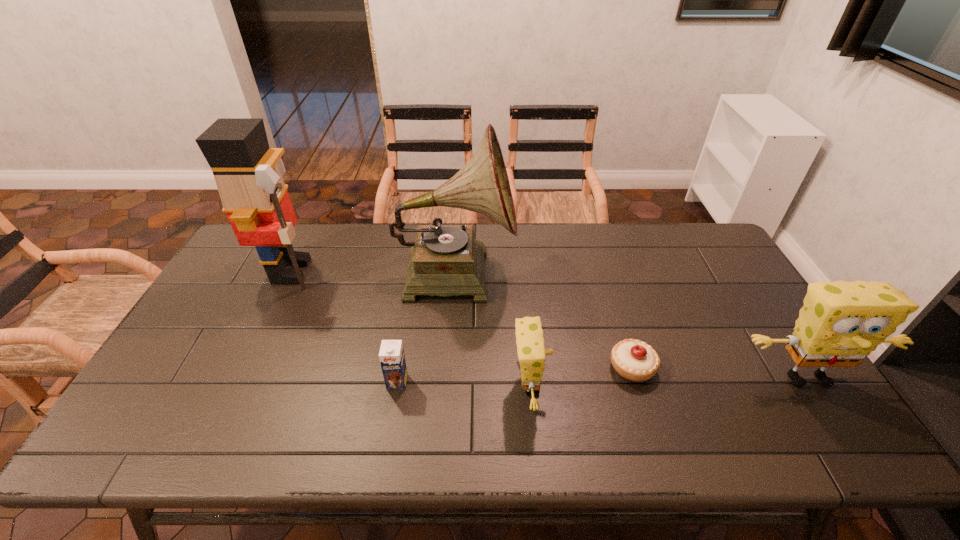
In order to click on vacant region located 0.210m from the horn of the record player in this screenshot , I will do coord(579,271).

The height and width of the screenshot is (540, 960). Identify the location of free space located 0.050m in front of the leftmost object holding the staff. (337, 271).

Locate an element on the screen. vacant area situated 0.050m on the front label of the chocolate milk is located at coordinates (394, 408).

Image resolution: width=960 pixels, height=540 pixels. Find the location of `free space located on the right of the second object from right to left`. free space located on the right of the second object from right to left is located at coordinates tap(762, 367).

Find the location of a particular element. The image size is (960, 540). record player at the far edge is located at coordinates (445, 260).

This screenshot has width=960, height=540. Find the location of `nutcracker located at the far edge`. nutcracker located at the far edge is located at coordinates (255, 198).

Locate an element on the screen. This screenshot has height=540, width=960. chocolate milk present at the near edge is located at coordinates (391, 355).

This screenshot has width=960, height=540. Find the location of `pastry that is positioned at the near edge`. pastry that is positioned at the near edge is located at coordinates (634, 360).

Locate an element on the screen. The width and height of the screenshot is (960, 540). object at the left edge is located at coordinates (255, 198).

Locate an element on the screen. The height and width of the screenshot is (540, 960). object present at the right edge is located at coordinates (841, 323).